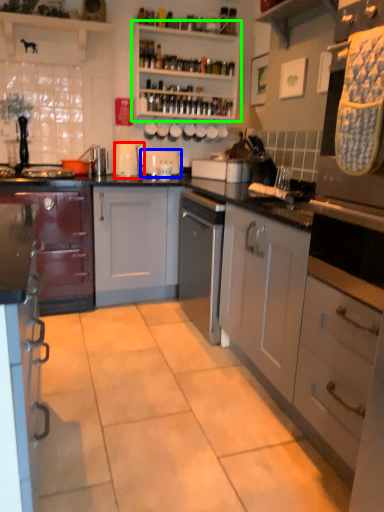
Question: Based on their relative distances, which object is farther from kitchen appliance (highlighted by a red box)? Choose from appliance (highlighted by a blue box) and shelf (highlighted by a green box).

Choices:
 (A) appliance
 (B) shelf

Answer: (B)